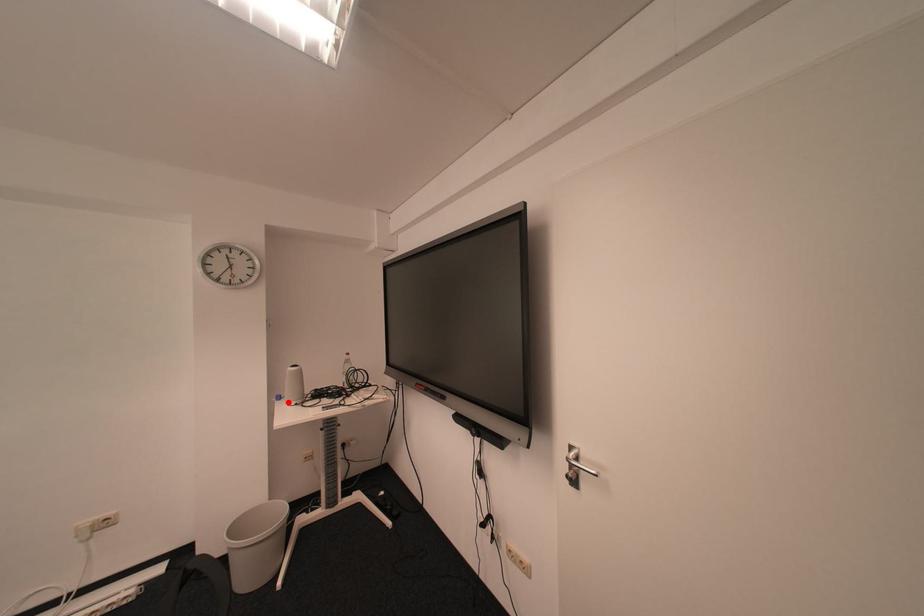
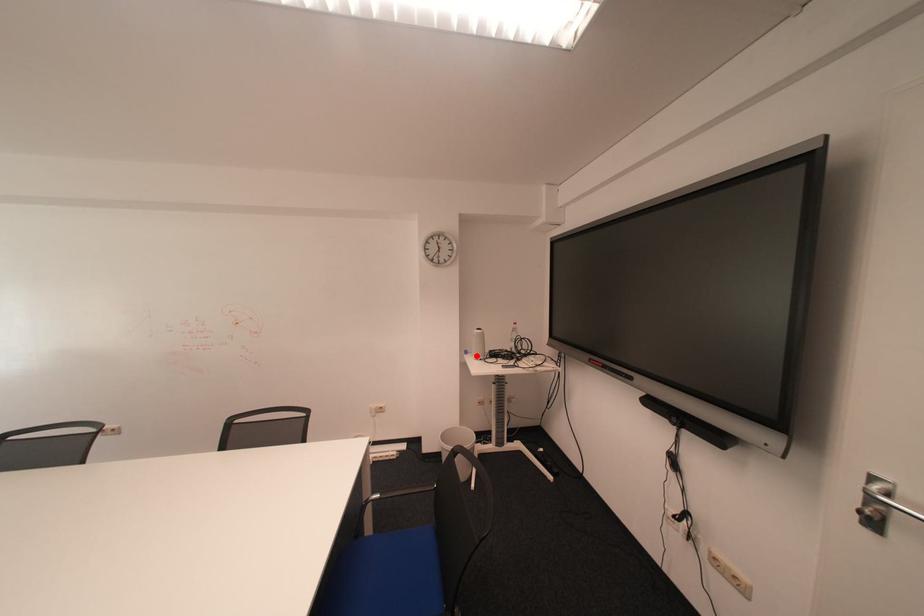
I am providing you with two images of the same scene from different viewpoints. A red point is marked on the first image and another point is marked on the second image. Is the red point in image1 aligned with the point shown in image2?

Yes